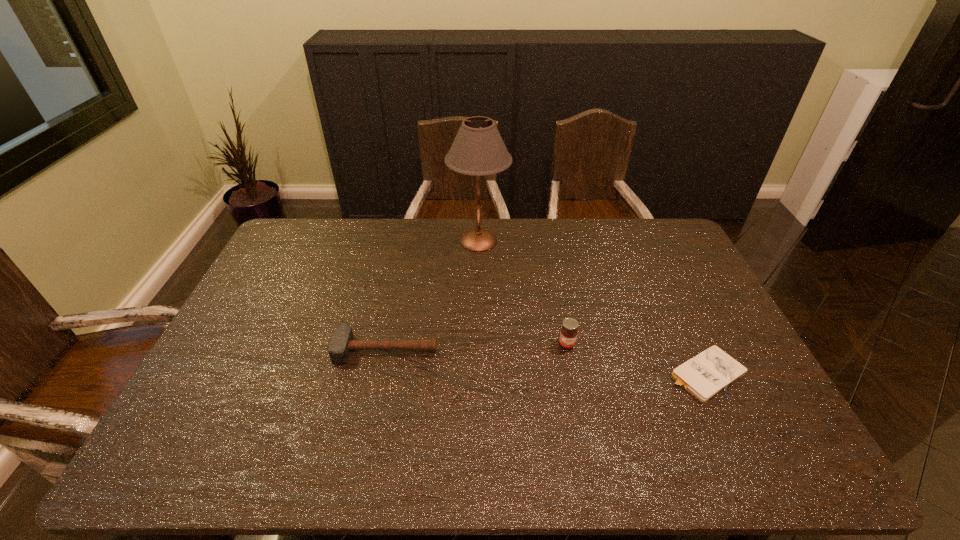
Identify the location of blank area in the image that satisfies the following two spatial constraints: 1. on the label side of the jam; 2. on the left side of the shortest object. Image resolution: width=960 pixels, height=540 pixels. (572, 374).

Find the location of a particular element. free space that satisfies the following two spatial constraints: 1. on the front-facing side of the shortest object; 2. on the right side of the tallest object is located at coordinates (478, 374).

Find the location of a particular element. The height and width of the screenshot is (540, 960). free space that satisfies the following two spatial constraints: 1. on the striking surface of the rightmost object; 2. on the left side of the hammer is located at coordinates (381, 374).